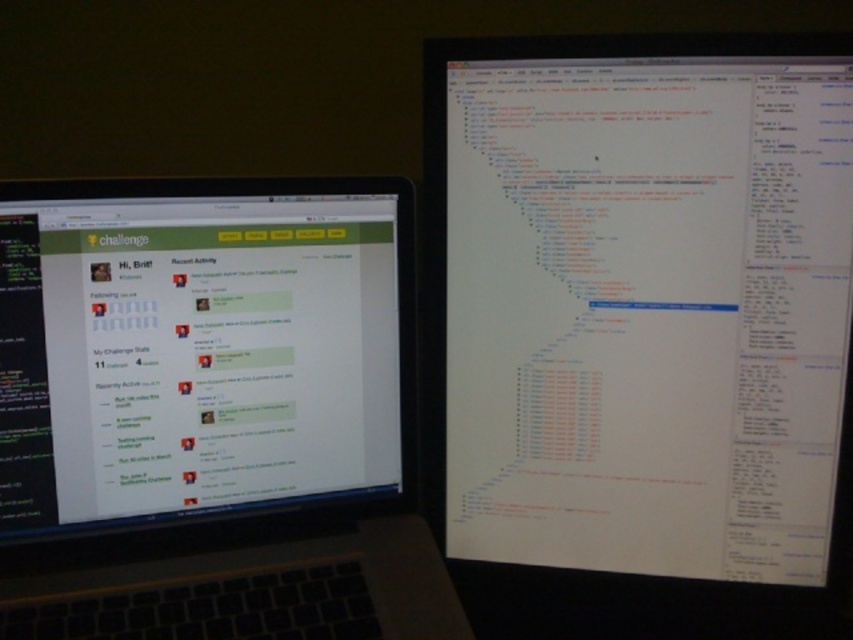
Question: Does white paper at center appear on the right side of black matte keyboard at lower left?

Choices:
 (A) no
 (B) yes

Answer: (B)

Question: Does white paper at center lie behind silver metallic laptop at left?

Choices:
 (A) yes
 (B) no

Answer: (A)

Question: Among these points, which one is nearest to the camera?

Choices:
 (A) (409, 524)
 (B) (73, 611)
 (C) (762, 227)

Answer: (B)

Question: Which of the following is the closest to the observer?

Choices:
 (A) (125, 636)
 (B) (616, 472)

Answer: (A)

Question: Which of these objects is positioned closest to the black matte keyboard at lower left?

Choices:
 (A) white paper at center
 (B) silver metallic laptop at left

Answer: (B)

Question: Is silver metallic laptop at left bigger than black matte keyboard at lower left?

Choices:
 (A) yes
 (B) no

Answer: (A)